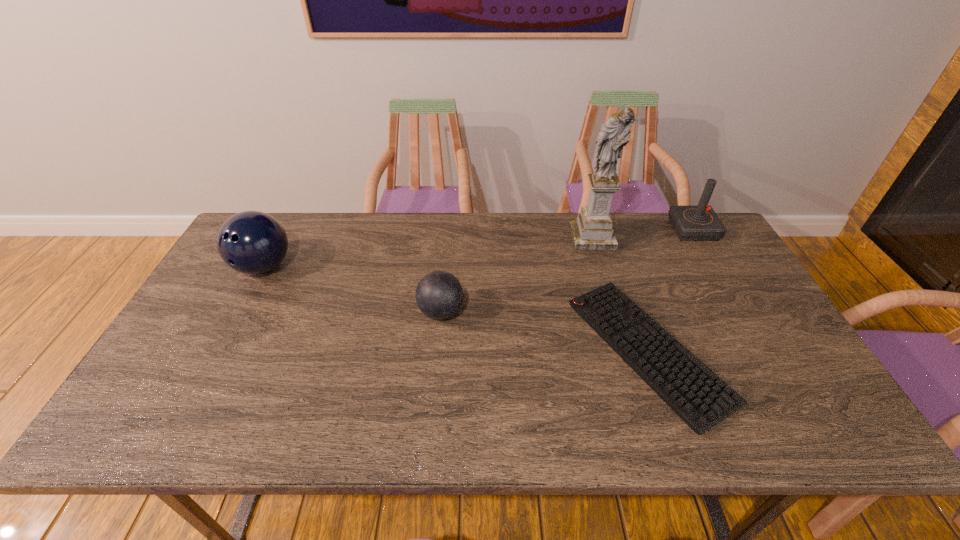
Locate an element on the screen. The width and height of the screenshot is (960, 540). empty space that is in between the rightmost object and the taller bowling ball is located at coordinates (478, 248).

You are a GUI agent. You are given a task and a screenshot of the screen. Output one action in this format:
    pyautogui.click(x=<x>, y=<y>)
    Task: Click on the free space between the shortest object and the second shortest object
    
    Given the screenshot: What is the action you would take?
    pyautogui.click(x=544, y=332)

Locate an element on the screen. free space between the rightmost object and the fourth object from right to left is located at coordinates (567, 271).

This screenshot has height=540, width=960. I want to click on empty location between the shortest object and the rightmost object, so click(x=670, y=291).

Locate an element on the screen. Image resolution: width=960 pixels, height=540 pixels. free spot between the left bowling ball and the rightmost object is located at coordinates (478, 248).

Where is `free space between the rightmost object and the right bowling ball`? The image size is (960, 540). free space between the rightmost object and the right bowling ball is located at coordinates (567, 271).

Locate an element on the screen. vacant area that lies between the sculpture and the rightmost object is located at coordinates (642, 233).

Image resolution: width=960 pixels, height=540 pixels. What are the coordinates of `object that can be found as the closest to the computer keyboard` in the screenshot? It's located at (593, 230).

You are a GUI agent. You are given a task and a screenshot of the screen. Output one action in this format:
    pyautogui.click(x=<x>, y=<y>)
    Task: Click on the fourth closest object to the sculpture
    The image size is (960, 540).
    Given the screenshot: What is the action you would take?
    pyautogui.click(x=252, y=242)

Identify the location of vacant space that satisfies the following two spatial constraints: 1. on the rectangular base of the joystick; 2. on the surface of the taller bowling ball near the finger holes. The height and width of the screenshot is (540, 960). (714, 267).